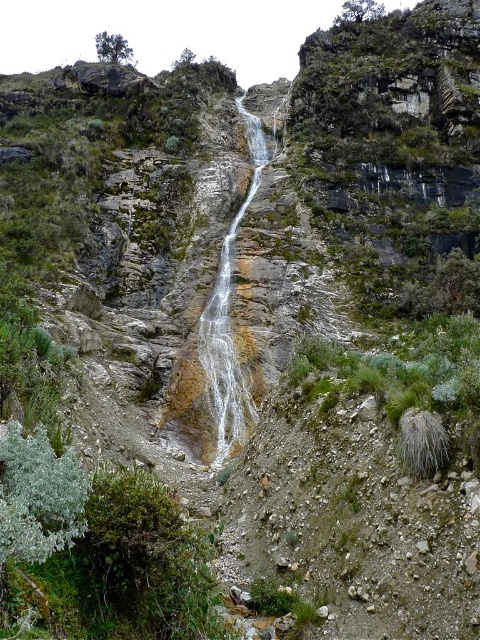
Question: Is green fuzzy bush at lower left wider than clear water at center?

Choices:
 (A) yes
 (B) no

Answer: (A)

Question: Which of these objects is positioned farthest from the green fuzzy bush at lower left?

Choices:
 (A) clear water at center
 (B) green leafy shrub at upper center

Answer: (B)

Question: Estimate the real-world distances between objects in this image. Which object is closer to the green fuzzy bush at lower left?

Choices:
 (A) green leafy shrub at upper center
 (B) clear water at center

Answer: (B)

Question: In this image, where is green fuzzy bush at lower left located relative to clear water at center?

Choices:
 (A) above
 (B) below

Answer: (B)

Question: Does green fuzzy bush at lower left have a greater width compared to clear water at center?

Choices:
 (A) yes
 (B) no

Answer: (A)

Question: Which object is farther from the camera taking this photo?

Choices:
 (A) green leafy shrub at upper center
 (B) green fuzzy bush at lower left
 (C) clear water at center

Answer: (A)